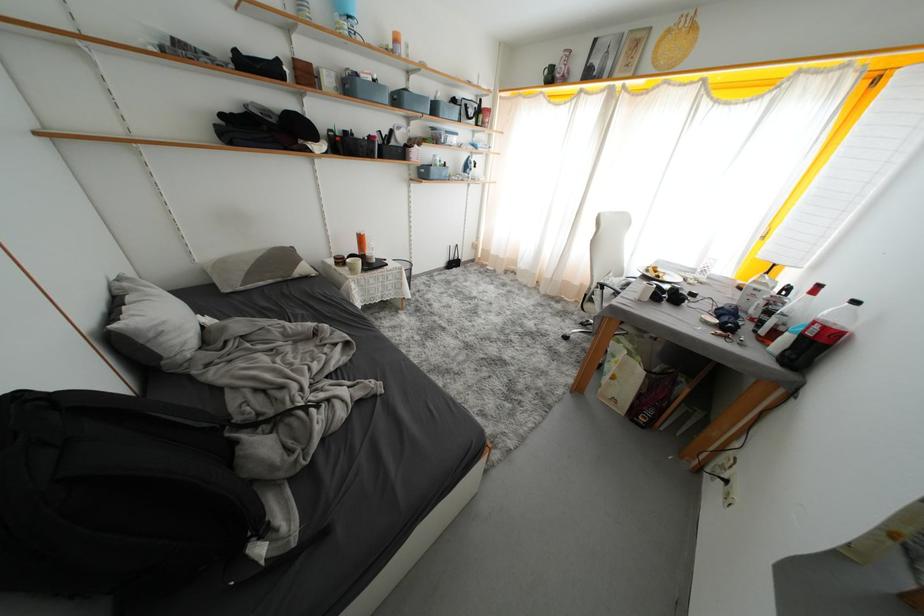
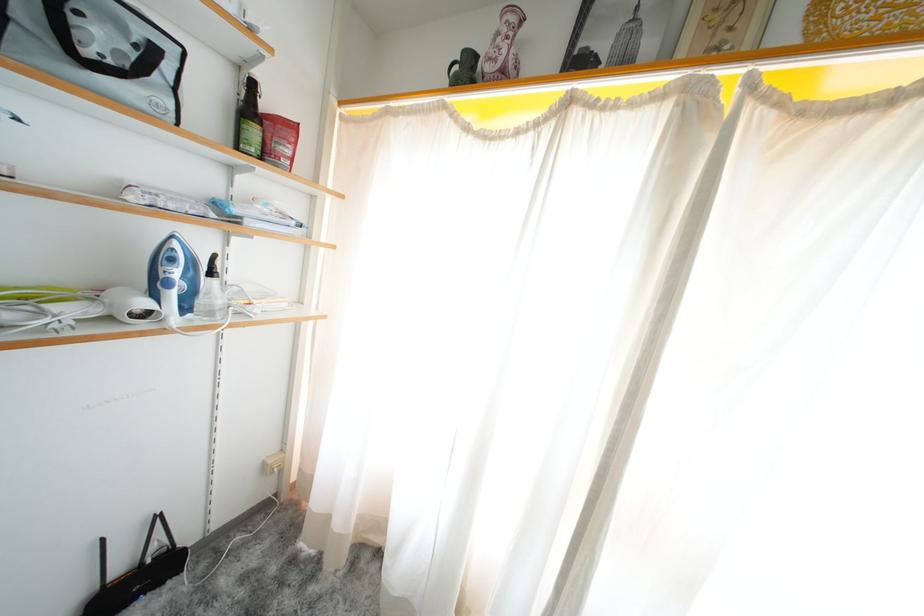
Locate, in the second image, the point that corresponds to (x=489, y=254) in the first image.

(306, 475)